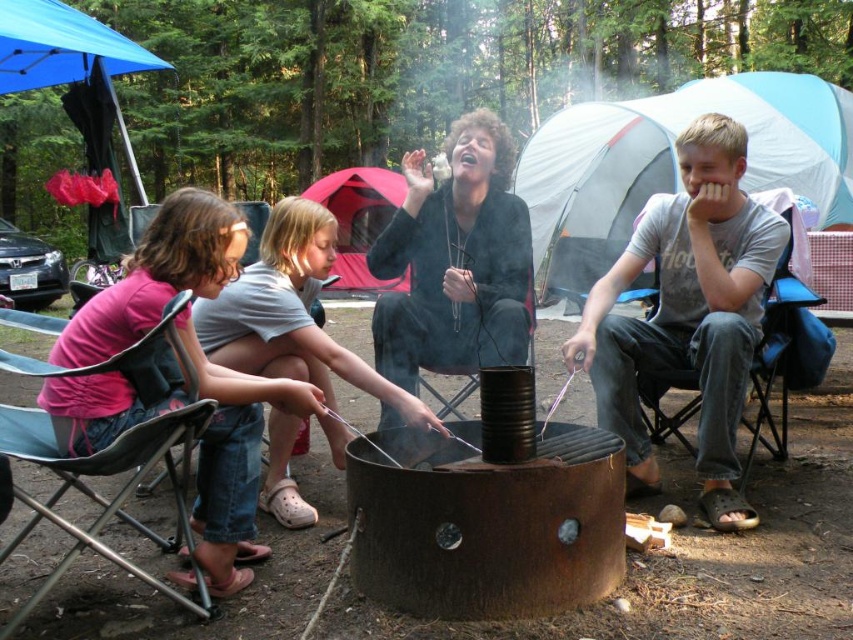
You are standing at the point labeled point [218,364] and want to walk to the point labeled point [489,113]. Which direction should you face to move towards your destination?

You should face north to move towards point [489,113] from point [218,364] because point [489,113] is behind point [218,364].